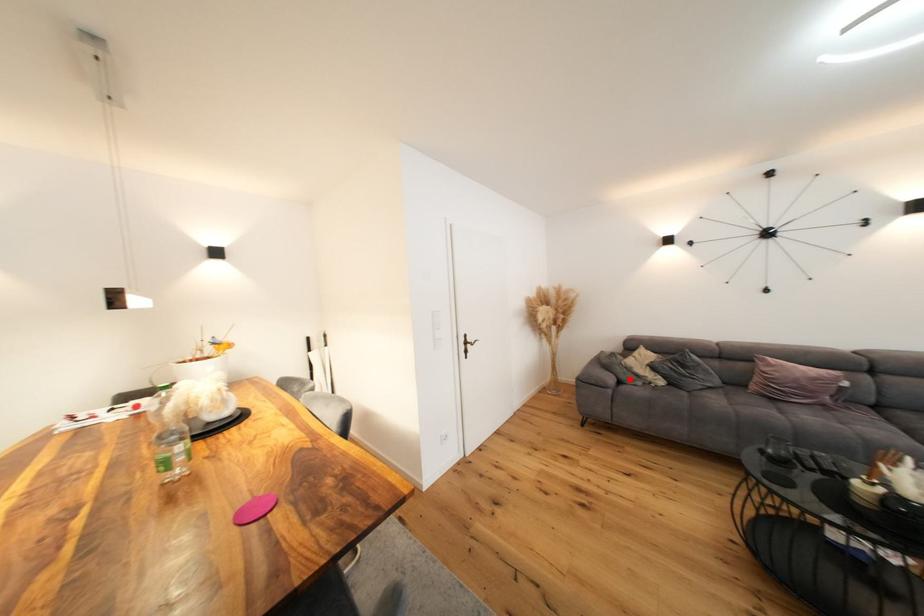
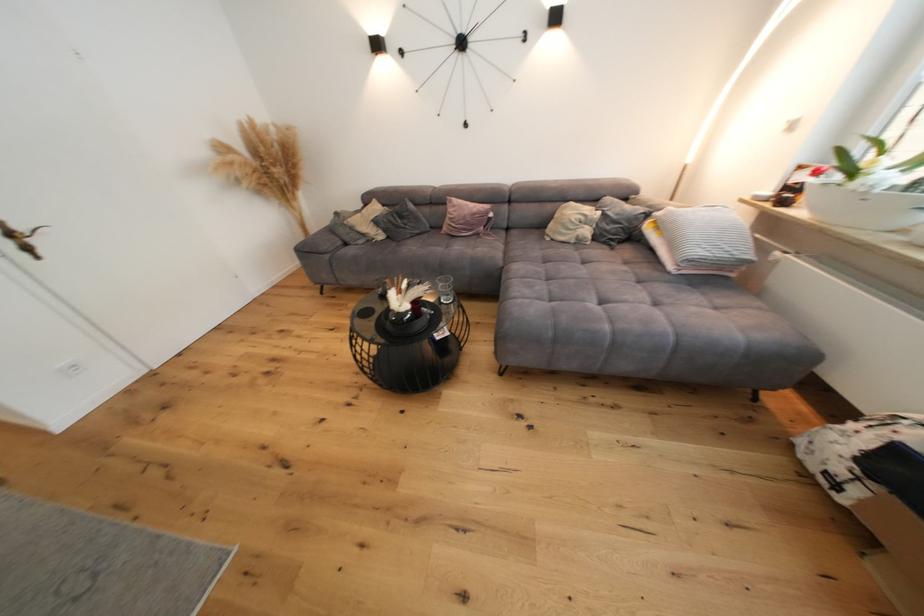
In the second image, find the point that corresponds to the highlighted location in the first image.

(354, 240)